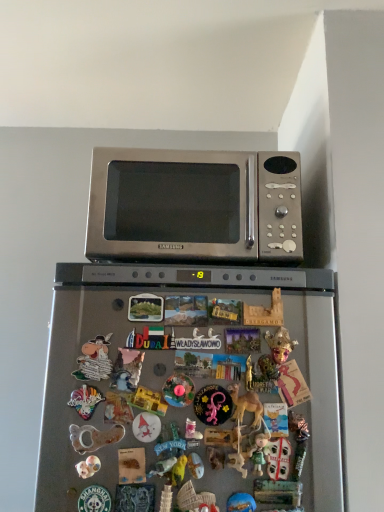
Question: From a real-world perspective, is satin silver refrigerator at center physically above metallic silver unicorn at center, arranged as the seventh toy when viewed from the right?

Choices:
 (A) no
 (B) yes

Answer: (A)

Question: Is satin silver refrigerator at center beside metallic silver unicorn at center, arranged as the seventh toy when viewed from the right?

Choices:
 (A) no
 (B) yes

Answer: (A)

Question: From the image's perspective, is satin silver refrigerator at center over metallic silver unicorn at center, arranged as the seventh toy when viewed from the right?

Choices:
 (A) no
 (B) yes

Answer: (A)

Question: Could you tell me if satin silver refrigerator at center is facing metallic silver unicorn at center, which is the fifth toy in left-to-right order?

Choices:
 (A) yes
 (B) no

Answer: (A)

Question: Can you confirm if satin silver refrigerator at center is positioned to the left of metallic silver unicorn at center, which is the fifth toy in left-to-right order?

Choices:
 (A) no
 (B) yes

Answer: (A)

Question: Based on their positions, is matte plastic toy at center, the tenth toy positioned from the left, located to the left or right of porcelain figurine at lower left, placed as the tenth toy when sorted from right to left?

Choices:
 (A) right
 (B) left

Answer: (A)

Question: From the image's perspective, is matte plastic toy at center, the tenth toy positioned from the left, positioned above or below porcelain figurine at lower left, placed as the tenth toy when sorted from right to left?

Choices:
 (A) above
 (B) below

Answer: (A)

Question: From a real-world perspective, is matte plastic toy at center, which ranks as the 2th toy in right-to-left order, physically located above or below porcelain figurine at lower left, placed as the tenth toy when sorted from right to left?

Choices:
 (A) above
 (B) below

Answer: (A)

Question: Considering the positions of matte plastic toy at center, which ranks as the 2th toy in right-to-left order, and porcelain figurine at lower left, placed as the tenth toy when sorted from right to left, in the image, is matte plastic toy at center, which ranks as the 2th toy in right-to-left order, wider or thinner than porcelain figurine at lower left, placed as the tenth toy when sorted from right to left,?

Choices:
 (A) wide
 (B) thin

Answer: (B)

Question: Considering the positions of porcelain figurine at lower left, which appears as the second toy when viewed from the left, and matte green figurine at lower center, which is the ninth toy from left to right, in the image, is porcelain figurine at lower left, which appears as the second toy when viewed from the left, taller or shorter than matte green figurine at lower center, which is the ninth toy from left to right,?

Choices:
 (A) tall
 (B) short

Answer: (B)

Question: Is porcelain figurine at lower left, which appears as the second toy when viewed from the left, in front of or behind matte green figurine at lower center, placed as the third toy when sorted from right to left, in the image?

Choices:
 (A) front
 (B) behind

Answer: (B)

Question: In terms of width, does porcelain figurine at lower left, which appears as the second toy when viewed from the left, look wider or thinner when compared to matte green figurine at lower center, which is the ninth toy from left to right?

Choices:
 (A) thin
 (B) wide

Answer: (B)

Question: From the image's perspective, is porcelain figurine at lower left, placed as the tenth toy when sorted from right to left, located above or below matte green figurine at lower center, which is the ninth toy from left to right?

Choices:
 (A) below
 (B) above

Answer: (A)

Question: Considering the positions of point (86, 356) and point (243, 497), is point (86, 356) closer or farther from the camera than point (243, 497)?

Choices:
 (A) closer
 (B) farther

Answer: (B)

Question: In terms of width, does matte plastic toy at center, marked as the 9th toy in a right-to-left arrangement, look wider or thinner when compared to blue rubber toy at center, arranged as the fourth toy when viewed from the right?

Choices:
 (A) wide
 (B) thin

Answer: (A)